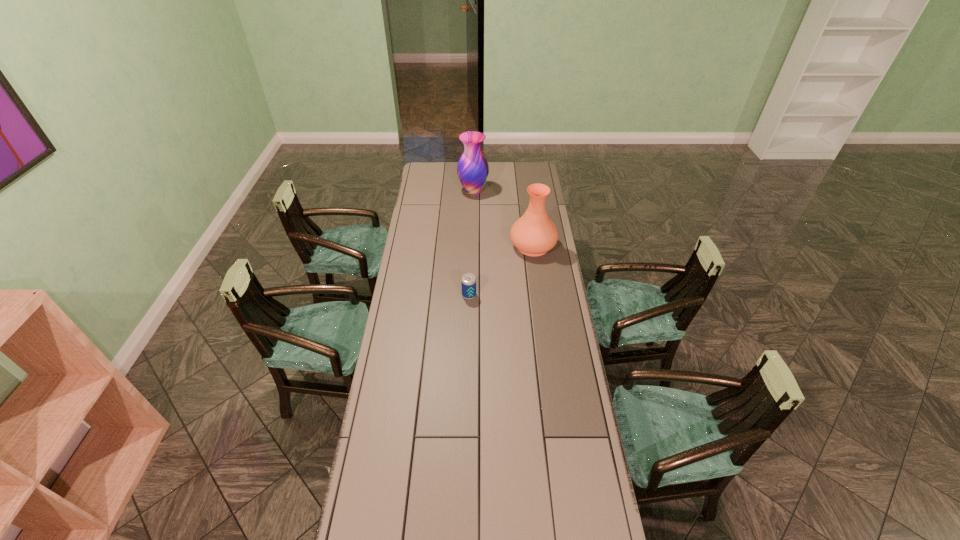
At what (x,y) coordinates should I click in order to perform the action: click on the closest object to the nearer vase. Please return your answer as a coordinate pair (x, y). The width and height of the screenshot is (960, 540). Looking at the image, I should click on (468, 282).

Choose which object is the second nearest neighbor to the second nearest object. Please provide its 2D coordinates. Your answer should be formatted as a tuple, i.e. [(x, y)], where the tuple contains the x and y coordinates of a point satisfying the conditions above.

[(472, 168)]

Image resolution: width=960 pixels, height=540 pixels. Identify the location of vacant position in the image that satisfies the following two spatial constraints: 1. on the back side of the beer can; 2. on the left side of the farther vase. [x=471, y=192].